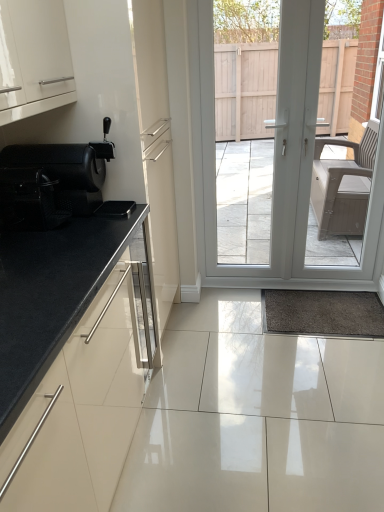
Question: From the image's perspective, would you say black mesh chair at left is positioned over black granite countertop at left?

Choices:
 (A) no
 (B) yes

Answer: (B)

Question: Does black mesh chair at left have a greater height compared to black granite countertop at left?

Choices:
 (A) no
 (B) yes

Answer: (A)

Question: From a real-world perspective, is black mesh chair at left on black granite countertop at left?

Choices:
 (A) yes
 (B) no

Answer: (A)

Question: Considering the relative positions of black mesh chair at left and black granite countertop at left in the image provided, is black mesh chair at left to the right of black granite countertop at left from the viewer's perspective?

Choices:
 (A) yes
 (B) no

Answer: (B)

Question: Is black mesh chair at left oriented towards black granite countertop at left?

Choices:
 (A) yes
 (B) no

Answer: (B)

Question: Is black mesh chair at left positioned far away from black granite countertop at left?

Choices:
 (A) no
 (B) yes

Answer: (A)

Question: Does black mesh chair at left have a greater height compared to white glossy door at center?

Choices:
 (A) yes
 (B) no

Answer: (B)

Question: Could you tell me if black mesh chair at left is facing white glossy door at center?

Choices:
 (A) yes
 (B) no

Answer: (B)

Question: Is white glossy door at center at the back of black mesh chair at left?

Choices:
 (A) yes
 (B) no

Answer: (B)

Question: From the image's perspective, would you say black mesh chair at left is shown under white glossy door at center?

Choices:
 (A) yes
 (B) no

Answer: (A)

Question: From a real-world perspective, is black mesh chair at left below white glossy door at center?

Choices:
 (A) no
 (B) yes

Answer: (A)

Question: From the image's perspective, would you say black mesh chair at left is positioned over white glossy door at center?

Choices:
 (A) yes
 (B) no

Answer: (B)

Question: Considering the relative sizes of white glossy door at center and black mesh chair at left in the image provided, is white glossy door at center thinner than black mesh chair at left?

Choices:
 (A) no
 (B) yes

Answer: (B)